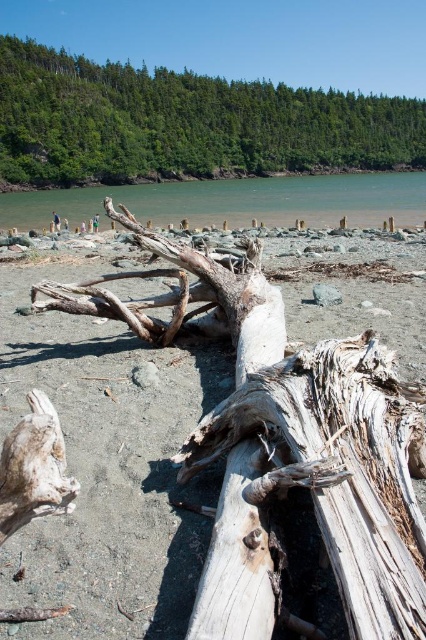
In the scene shown: You are standing on the beach and want to take a photo of the gray weathered wood log at center. To include the green leafy tree at upper center in the same frame, should you pan your camera to the left or the right?

The green leafy tree at upper center is to the right of the gray weathered wood log at center, so you should pan your camera to the right to include both in the same frame.

You are standing at the origin point of the coordinate system in the coastal scene. You want to walk to the weathered wood driftwood at center. According to the coordinates, in which direction should you move first?

Since the weathered wood driftwood at center is located at coordinates point (x=293, y=464), you should move to the right and forward first to reach it.

You are standing at the center of the beach and want to take a photo of the green leafy tree at upper center. Which direction should you face to ensure the tree is in the center of your photo?

The green leafy tree at upper center is located at point coordinates [184,124], so you should face the upper center direction to have the tree centered in your photo.